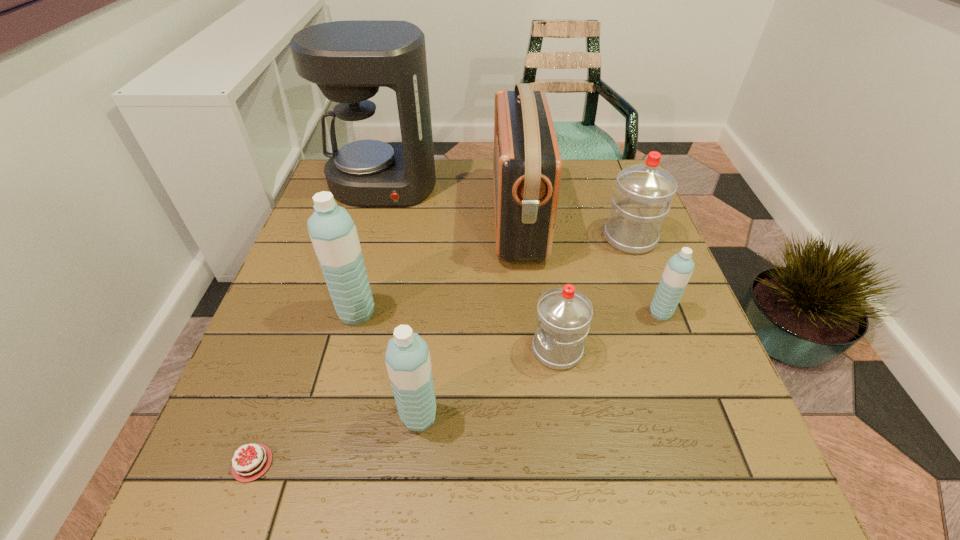
At what (x,y) coordinates should I click in order to perform the action: click on object that is at the near edge. Please return your answer as a coordinate pair (x, y). Image resolution: width=960 pixels, height=540 pixels. Looking at the image, I should click on (247, 466).

Find the location of `coffee maker located at the left edge`. coffee maker located at the left edge is located at coordinates (348, 60).

Where is `water bottle that is positioned at the left edge`? water bottle that is positioned at the left edge is located at coordinates (333, 233).

Where is `chocolate cake that is at the left edge`? This screenshot has width=960, height=540. chocolate cake that is at the left edge is located at coordinates (247, 466).

Identify the location of object that is at the far left corner. (348, 60).

This screenshot has width=960, height=540. Identify the location of object located in the near left corner section of the desktop. (247, 466).

At what (x,y) coordinates should I click in order to perform the action: click on vacant space at the far edge of the desktop. Please return your answer as a coordinate pair (x, y). The height and width of the screenshot is (540, 960). Looking at the image, I should click on (570, 191).

In the image, there is a desktop. Find the location of `vacant region at the left edge`. vacant region at the left edge is located at coordinates (276, 368).

In order to click on blank space at the right edge of the desktop in this screenshot , I will do `click(604, 211)`.

You are a GUI agent. You are given a task and a screenshot of the screen. Output one action in this format:
    pyautogui.click(x=<x>, y=<y>)
    Task: Click on the vacant space at the far right corner of the desktop
    The height and width of the screenshot is (540, 960).
    Given the screenshot: What is the action you would take?
    pyautogui.click(x=587, y=202)